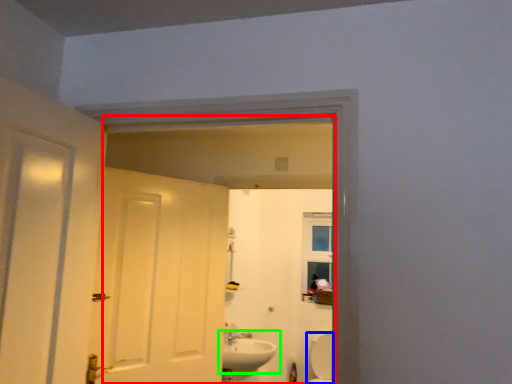
Question: Considering the real-world distances, which object is farthest from mirror (highlighted by a red box)? bath (highlighted by a blue box) or sink (highlighted by a green box)?

Choices:
 (A) bath
 (B) sink

Answer: (B)